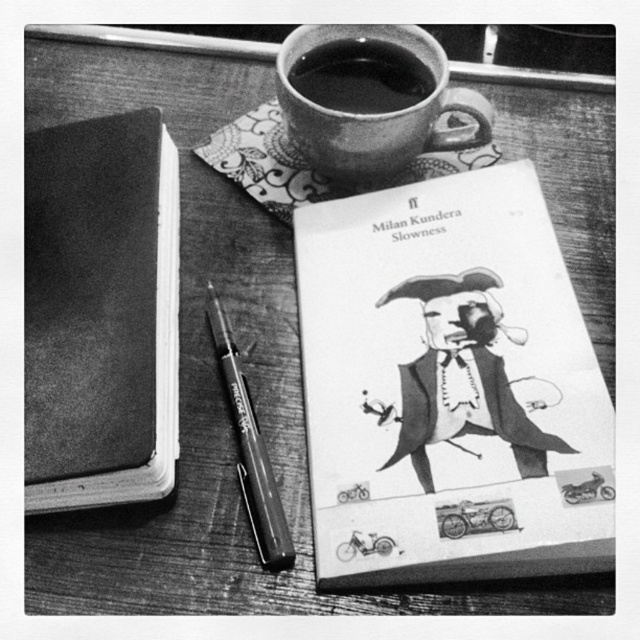
Question: Estimate the real-world distances between objects in this image. Which object is closer to the metallic pen at center?

Choices:
 (A) black ceramic mug at upper center
 (B) paperback book at center
 (C) matte ceramic mug at upper center
 (D) smooth matte notebook at left

Answer: (D)

Question: Can you confirm if matte ceramic mug at upper center is positioned above black ceramic mug at upper center?

Choices:
 (A) yes
 (B) no

Answer: (B)

Question: Which point is farther to the camera?

Choices:
 (A) metallic pen at center
 (B) black ceramic mug at upper center
 (C) smooth matte notebook at left
 (D) matte ceramic mug at upper center

Answer: (B)

Question: Among these points, which one is nearest to the camera?

Choices:
 (A) (369, 104)
 (B) (428, 44)
 (C) (268, 515)

Answer: (C)

Question: Can you confirm if paperback book at center is wider than smooth matte notebook at left?

Choices:
 (A) yes
 (B) no

Answer: (A)

Question: Does matte ceramic mug at upper center have a lesser width compared to black ceramic mug at upper center?

Choices:
 (A) no
 (B) yes

Answer: (A)